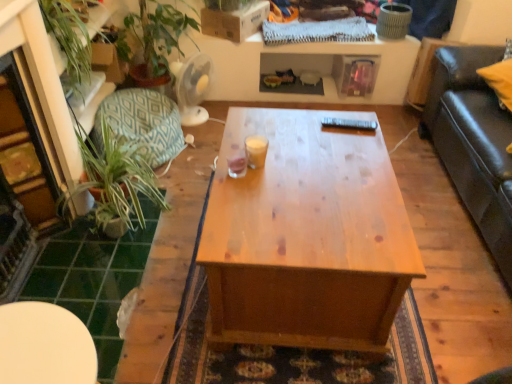
Where is `vacant area in front of translucent glass at center, which appears as the 1th coffee cup when viewed from the left`? The height and width of the screenshot is (384, 512). vacant area in front of translucent glass at center, which appears as the 1th coffee cup when viewed from the left is located at coordinates (237, 197).